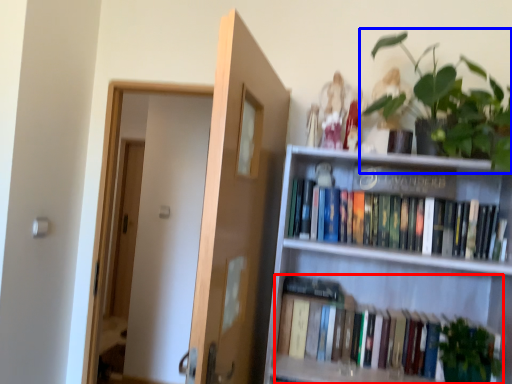
Question: Which object appears closest to the camera in this image, book (highlighted by a red box) or houseplant (highlighted by a blue box)?

Choices:
 (A) book
 (B) houseplant

Answer: (B)